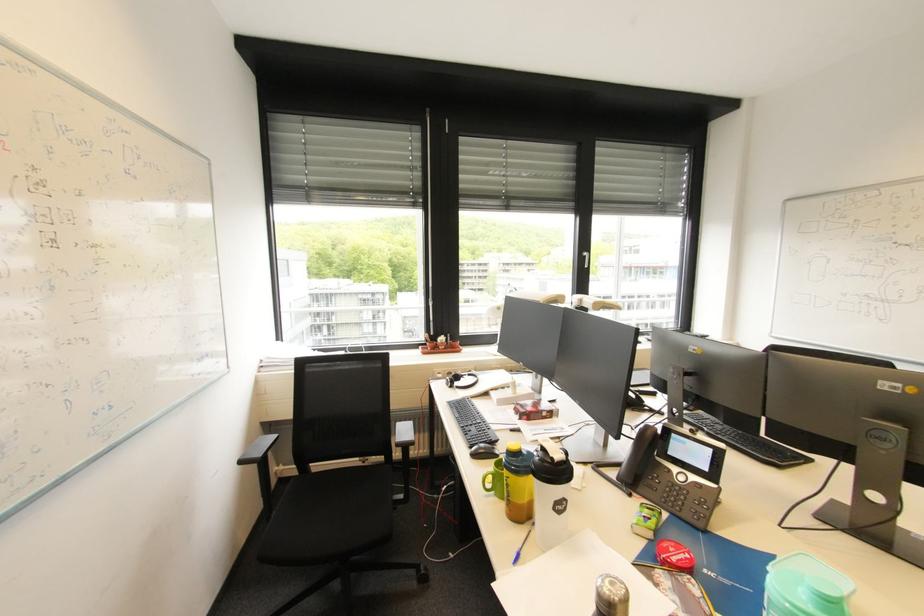
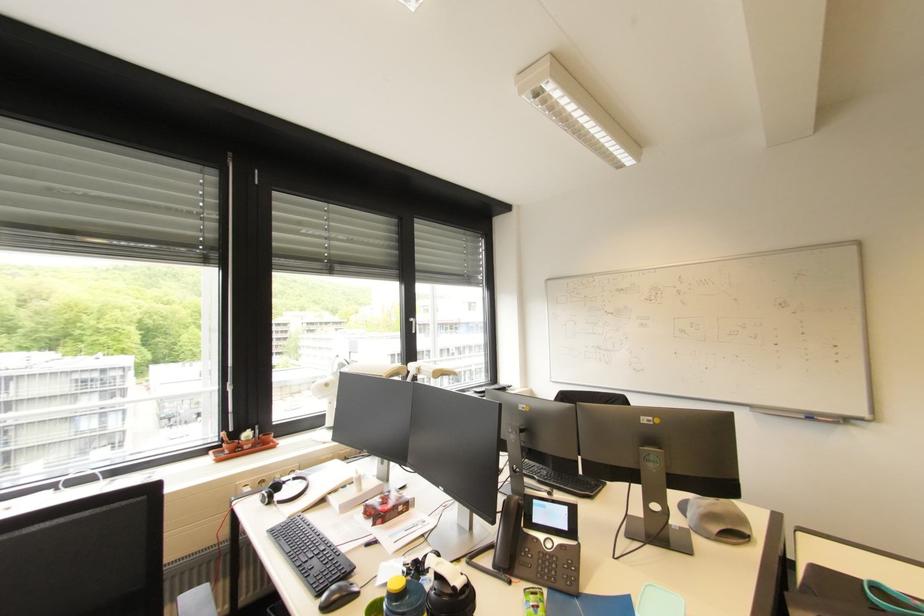
The point at (521,463) is marked in the first image. Where is the corresponding point in the second image?

(408, 608)